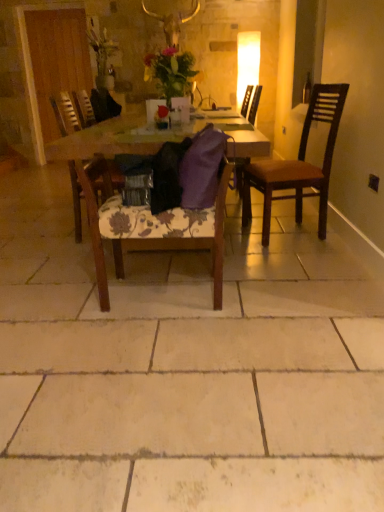
The height and width of the screenshot is (512, 384). Find the location of `free space in front of wooden chair at center, which ranks as the second chair in left-to-right order`. free space in front of wooden chair at center, which ranks as the second chair in left-to-right order is located at coordinates (146, 350).